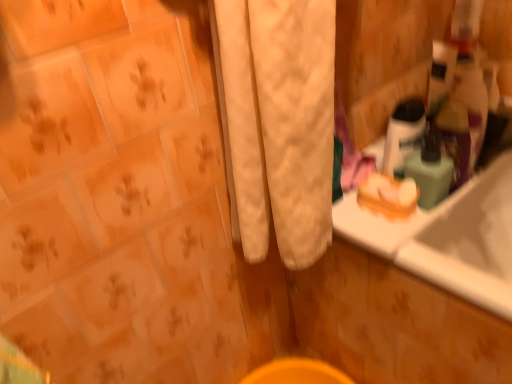
Identify the location of vacant region in front of orange matte soap at right. The height and width of the screenshot is (384, 512). (407, 241).